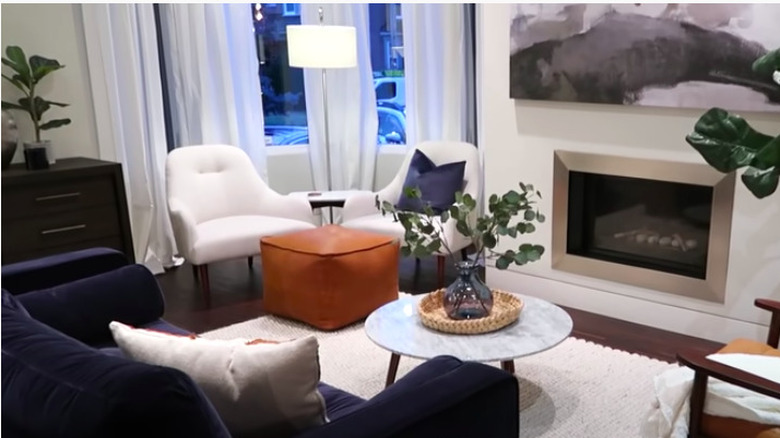
The height and width of the screenshot is (438, 780). I want to click on tables, so click(x=461, y=344), click(x=331, y=193).